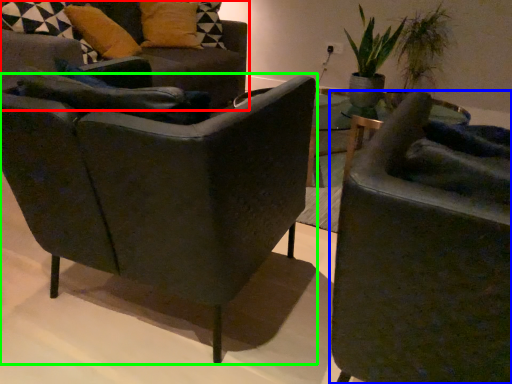
Question: Estimate the real-world distances between objects in this image. Which object is closer to chair (highlighted by a red box), chair (highlighted by a blue box) or chair (highlighted by a green box)?

Choices:
 (A) chair
 (B) chair

Answer: (B)